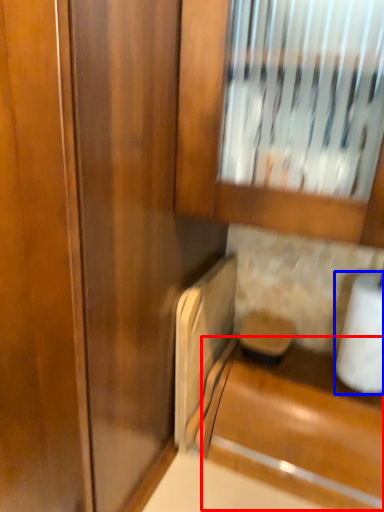
Question: Which of the following is the farthest to the observer, cabinetry (highlighted by a red box) or toilet paper (highlighted by a blue box)?

Choices:
 (A) cabinetry
 (B) toilet paper

Answer: (B)